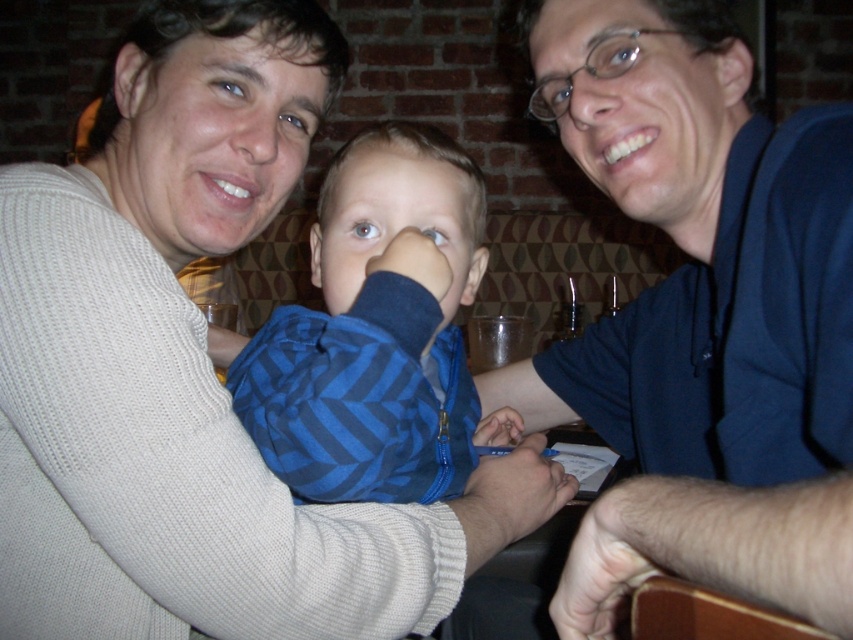
Based on the photo, in the scene described, there are three people seated at a restaurant or cafe. The child in the center is wearing a blue and black striped shirt. The person on the left is wearing a light beige sweater. The third person is seated to the right. A point at coordinates (x=193, y=371) marks the location of a white knit sweater at upper left. If you were to draw a straight line from the child in the center to the white knit sweater at upper left, would this line pass in front of or behind the person on the left?

The line from the child in the center to the white knit sweater at upper left would pass in front of the person on the left because the white knit sweater at upper left is located at point (x=193, y=371), which is positioned above and to the left of the person on the left, indicating it is in the foreground relative to them.

You are a photographer trying to capture a candid shot of the blue shirt at center without including the white knit sweater at upper left. Based on their positions, can you position yourself in a way to achieve this?

The white knit sweater at upper left is located below the blue shirt at center, so positioning yourself slightly above the blue shirt at center and framing the shot to exclude the lower area where the white knit sweater at upper left is situated would allow you to capture the blue shirt at center without including the white knit sweater at upper left.

You are a photographer setting up a camera to capture the scene. The camera has a limited focus area that can only accommodate objects within a 20cm width. You need to ensure both the white knit sweater at upper left and the blue shirt at center are fully in focus. Based on their widths, will the focus area be sufficient?

The white knit sweater at upper left might be wider than blue shirt at center. Since the focus area can only accommodate up to 20cm, if the white knit sweater at upper left exceeds this width, it may not fit entirely within the focus area. However, if it is within 20cm, both should fit. The exact width isn not provided, so it depends on the actual measurement.